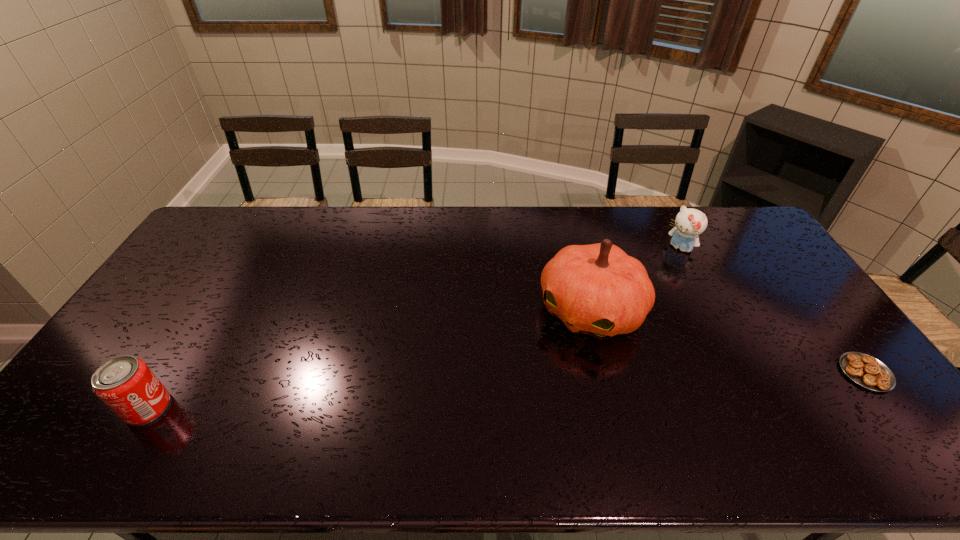
This screenshot has width=960, height=540. Identify the location of vacant space on the desktop that is between the leftmost object and the pastry and is positioned on the front-facing side of the farthest object. (540, 389).

Where is `free spot on the desktop that is between the leftmost object and the pastry and is positioned on the front-facing side of the second object from left to right`? The height and width of the screenshot is (540, 960). free spot on the desktop that is between the leftmost object and the pastry and is positioned on the front-facing side of the second object from left to right is located at coordinates (532, 389).